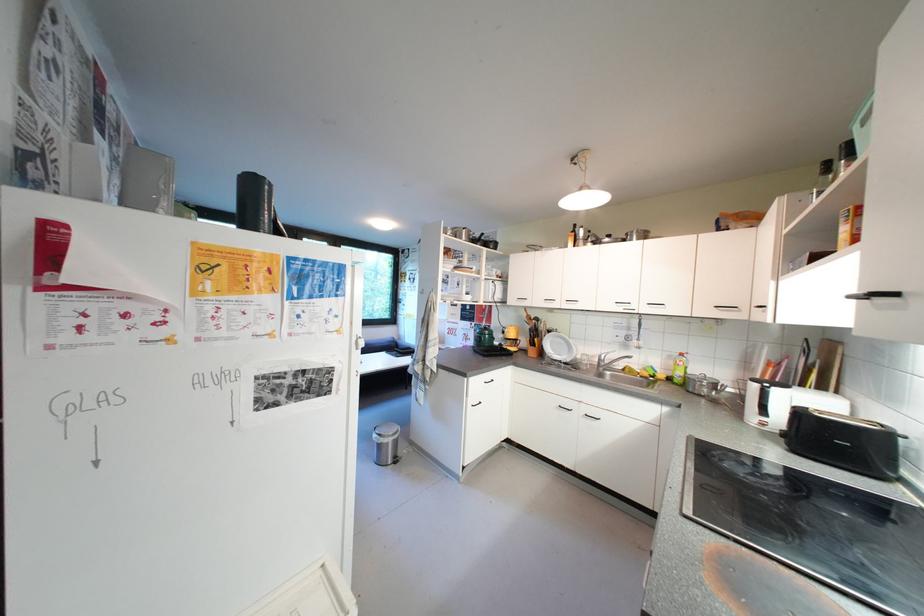
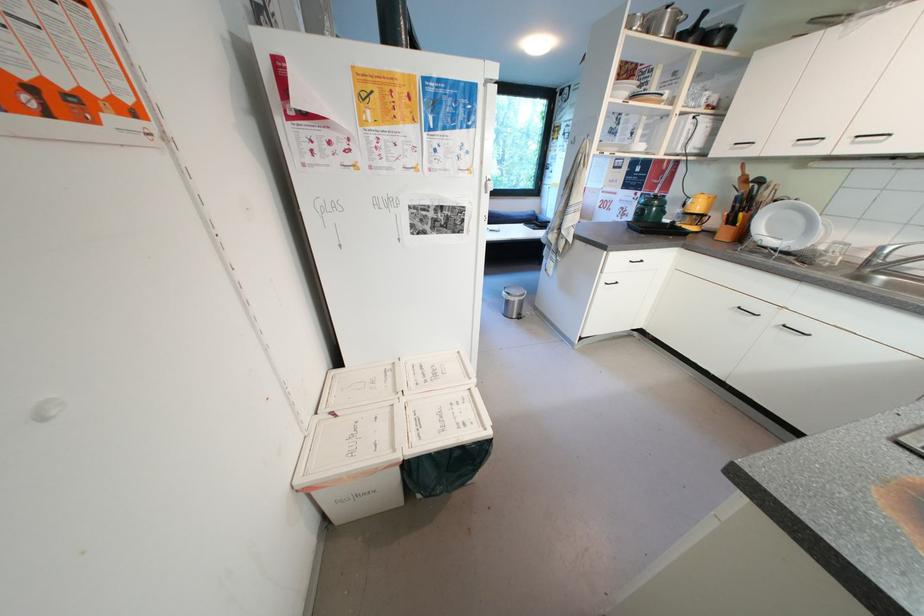
Find the pixel in the second image that matches (x=465, y=238) in the first image.

(657, 33)